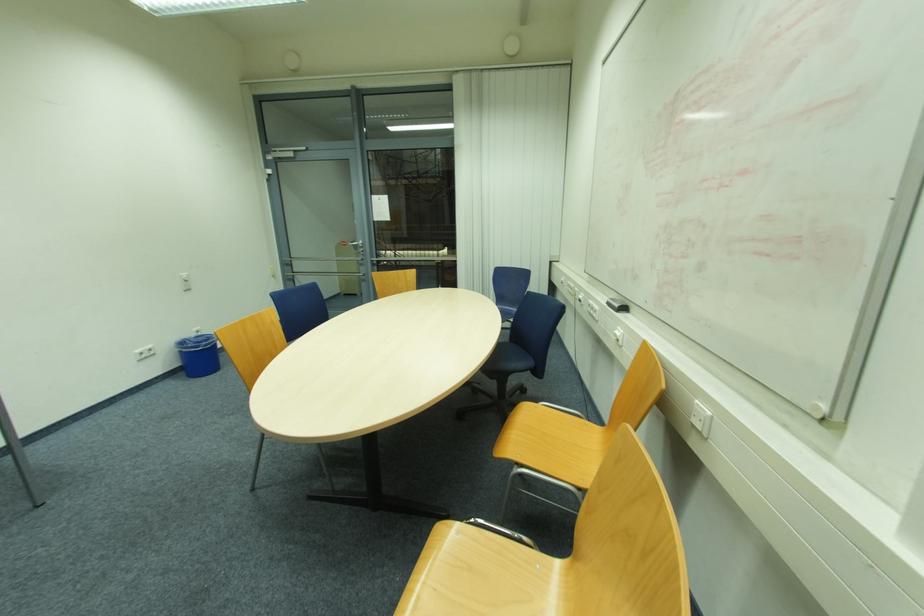
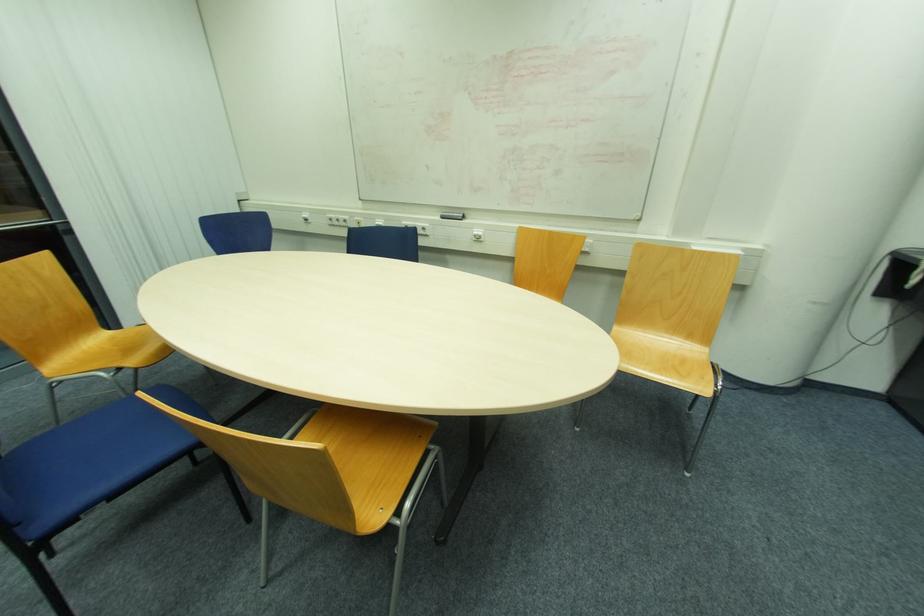
Where in the second image is the point corresponding to [611,305] from the first image?

(444, 217)